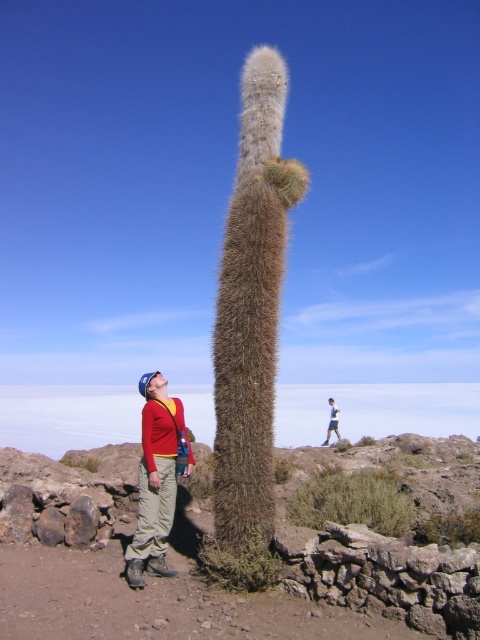
Question: Which object is the farthest from the fuzzy brown cactus at center?

Choices:
 (A) light blue denim jacket at lower center
 (B) green spiky cactus at center
 (C) red wool sweater at lower left

Answer: (A)

Question: Which point is farther from the camera taking this photo?

Choices:
 (A) (275, 264)
 (B) (332, 428)
 (C) (182, 422)

Answer: (B)

Question: Does green spiky cactus at center appear under light blue denim jacket at lower center?

Choices:
 (A) no
 (B) yes

Answer: (A)

Question: Does fuzzy brown cactus at center have a larger size compared to red wool sweater at lower left?

Choices:
 (A) yes
 (B) no

Answer: (A)

Question: Does red wool sweater at lower left appear under light blue denim jacket at lower center?

Choices:
 (A) no
 (B) yes

Answer: (A)

Question: Among these points, which one is nearest to the camera?

Choices:
 (A) (160, 445)
 (B) (330, 412)
 (C) (439, 502)
 (D) (269, 108)

Answer: (A)